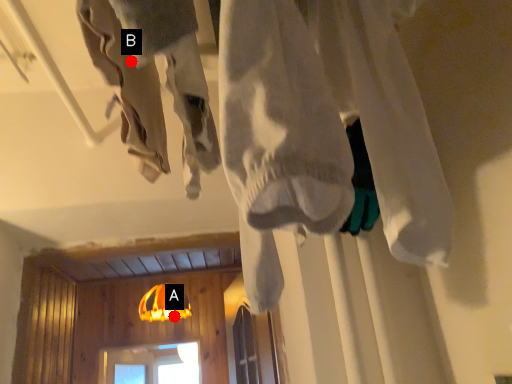
Question: Two points are circled on the image, labeled by A and B beside each circle. Which of the following is the closest to the observer?

Choices:
 (A) A is closer
 (B) B is closer

Answer: (B)